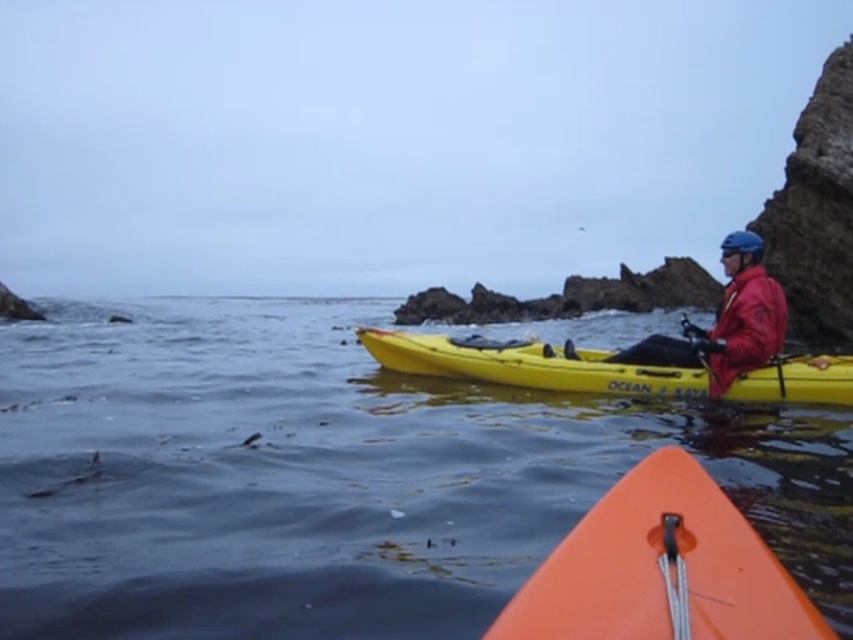
You are in a kayak and want to check the water quality in front of you. You see the clear water at center and the red matte jacket at right. Which object is closer to you?

The clear water at center is closer to the viewer than the red matte jacket at right.

In the scene shown: You are a photographer positioned at the camera location. You want to capture a photo of the orange matte kayak at lower center for a travel magazine. The magazine requires the kayak to be at least 5 feet away from the camera to ensure clarity. Based on the scene description, will the kayak meet the magazine requirement?

The orange matte kayak at lower center is only 4.70 feet away from the camera, which is less than the required 5 feet. Therefore, it does not meet the magazine requirement for clarity.